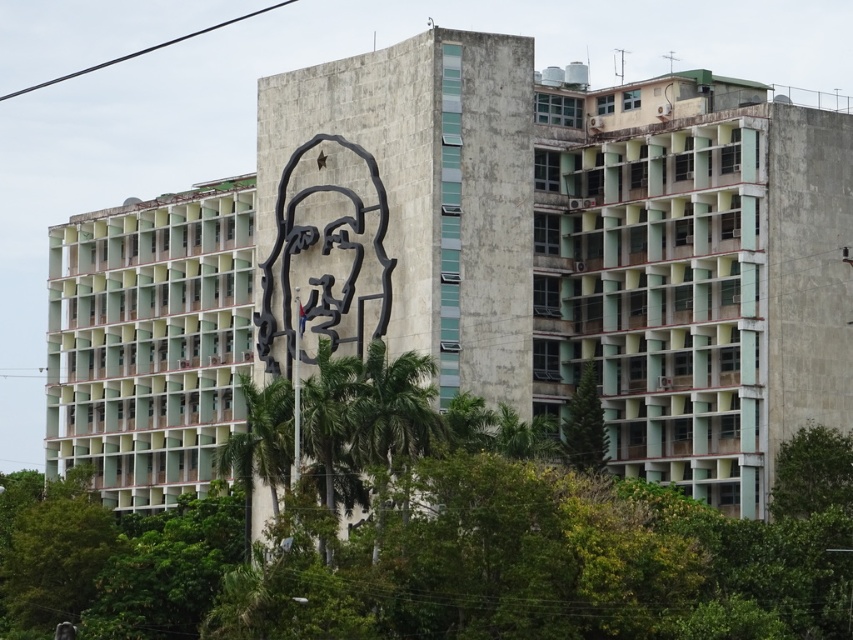
Question: Is green leafy tree at center bigger than green leafy tree at center-right?

Choices:
 (A) no
 (B) yes

Answer: (B)

Question: Which point is farther from the camera taking this photo?

Choices:
 (A) (479, 582)
 (B) (585, 420)

Answer: (B)

Question: Observing the image, what is the correct spatial positioning of green leafy tree at center in reference to green leafy tree at center-right?

Choices:
 (A) right
 (B) left

Answer: (B)

Question: Is green leafy tree at center below green leafy tree at center-right?

Choices:
 (A) yes
 (B) no

Answer: (A)

Question: Which point is farther from the camera taking this photo?

Choices:
 (A) (33, 480)
 (B) (587, 464)

Answer: (A)